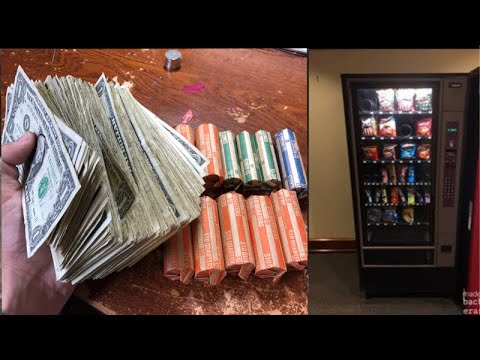
At what (x,y) coordinates should I click in order to perform the action: click on baseboard. Please return your answer as a coordinate pair (x, y). This screenshot has height=360, width=480. Looking at the image, I should click on (339, 243).